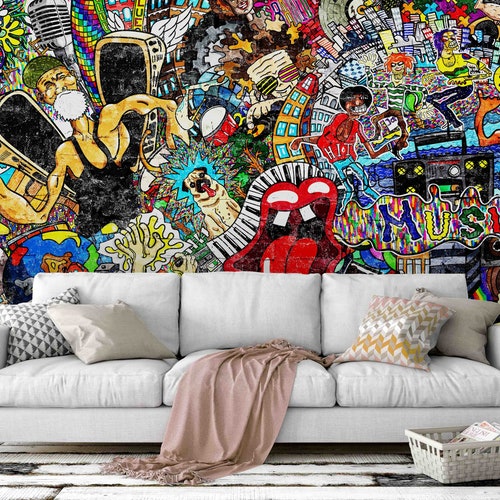
The image size is (500, 500). I want to click on above couch, so click(x=253, y=231).